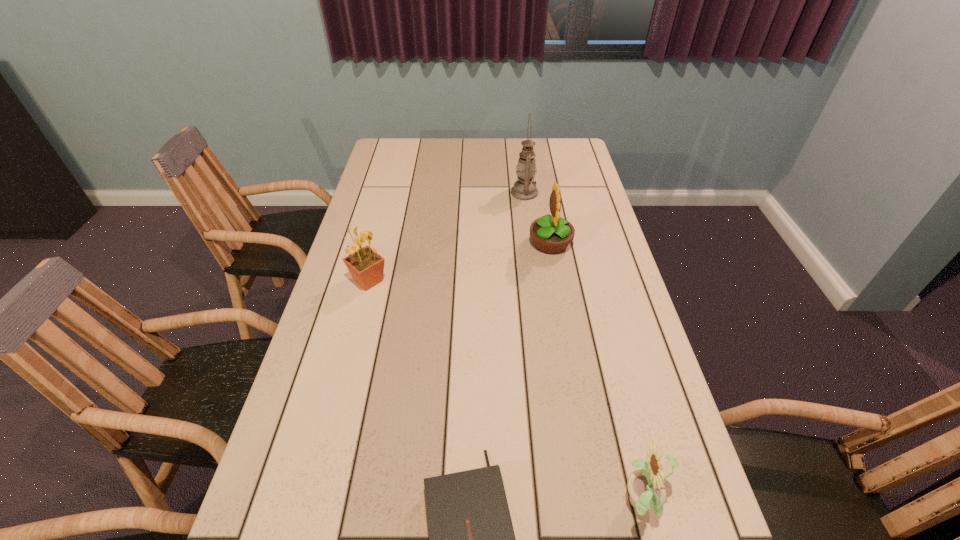
Locate an element on the screen. the tallest object is located at coordinates coord(524,188).

What are the coordinates of `oil lamp` in the screenshot? It's located at (524, 188).

At what (x,y) coordinates should I click in order to perform the action: click on the second farthest object. Please return your answer as a coordinate pair (x, y). The width and height of the screenshot is (960, 540). Looking at the image, I should click on (552, 234).

Locate an element on the screen. This screenshot has height=540, width=960. the second nearest sunflower is located at coordinates (366, 266).

The width and height of the screenshot is (960, 540). I want to click on the leftmost sunflower, so click(366, 266).

Locate an element on the screen. the nearest sunflower is located at coordinates (647, 492).

Where is `free location located 0.160m on the right of the oil lamp`? The height and width of the screenshot is (540, 960). free location located 0.160m on the right of the oil lamp is located at coordinates (582, 192).

Identify the location of vacant space situated on the face of the second farthest object. This screenshot has width=960, height=540. (489, 244).

What are the coordinates of `vacant region located on the face of the second farthest object` in the screenshot? It's located at (479, 244).

The image size is (960, 540). I want to click on vacant space positioned 0.190m on the face of the second farthest object, so click(x=470, y=244).